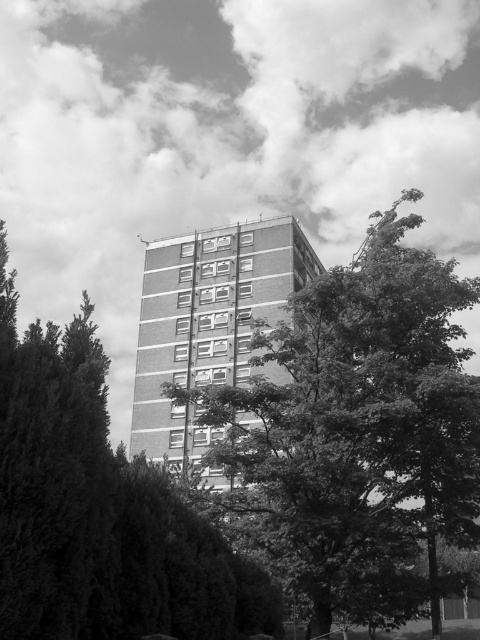
Which is below, dark green leafy tree at center or green leafy tree at center?

dark green leafy tree at center

Does dark green leafy tree at center have a smaller size compared to green leafy tree at center?

No.

Locate an element on the screen. This screenshot has height=640, width=480. dark green leafy tree at center is located at coordinates (357, 429).